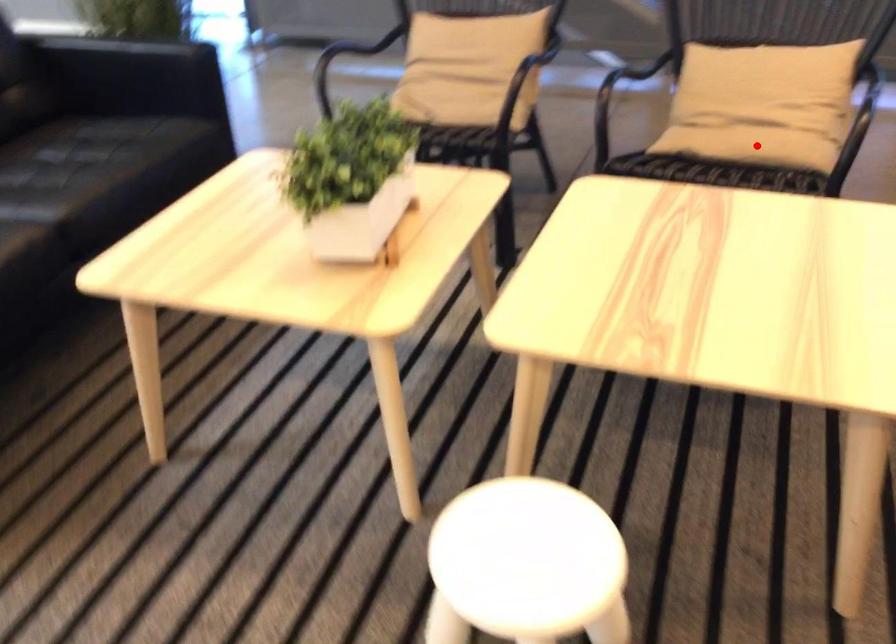
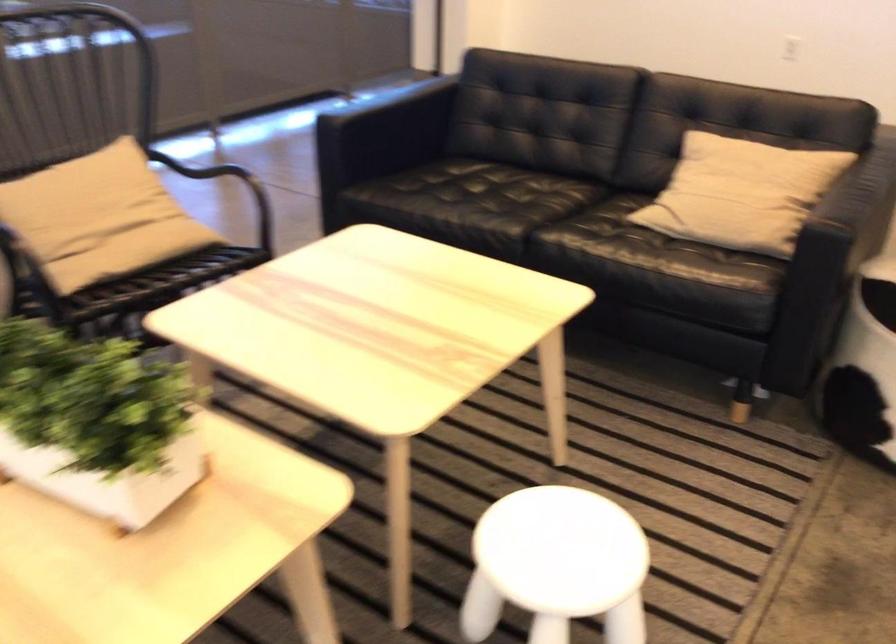
Locate, in the second image, the point that corresponds to the highlighted location in the first image.

(151, 254)